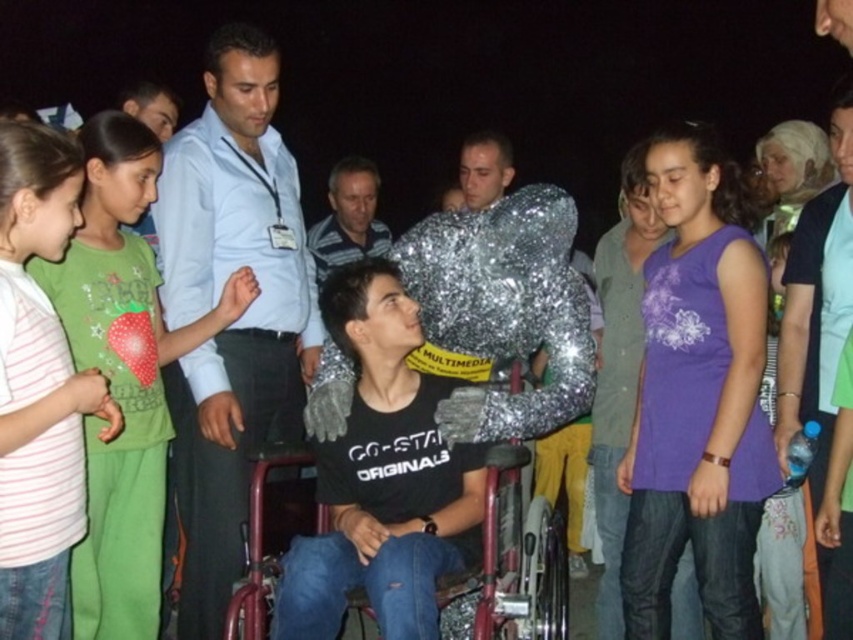
Measure the distance between point (90,273) and camera.

Point (90,273) is 3.42 meters from camera.

What are the coordinates of `green matte shirt at left` in the screenshot? It's located at pos(123,376).

Between point (67, 273) and point (347, 196), which one is positioned in front?

Point (67, 273) is more forward.

Find the location of a particular element. This screenshot has height=640, width=853. green matte shirt at left is located at coordinates (123, 376).

Is striped cotton shirt at left shorter than metallic red wheelchair at center?

Incorrect, striped cotton shirt at left's height does not fall short of metallic red wheelchair at center's.

Between point (49, 611) and point (527, 458), which one is positioned in front?

Point (49, 611) is in front.

Locate an element on the screen. This screenshot has height=640, width=853. striped cotton shirt at left is located at coordinates (39, 387).

Is green matte shirt at left below striped cotton shirt at left?

Correct, green matte shirt at left is located below striped cotton shirt at left.

Looking at this image, between green matte shirt at left and striped cotton shirt at left, which one appears on the left side from the viewer's perspective?

striped cotton shirt at left is more to the left.

Is point (61, 282) closer to viewer compared to point (54, 257)?

That is False.

In order to click on green matte shirt at left in this screenshot , I will do `click(123, 376)`.